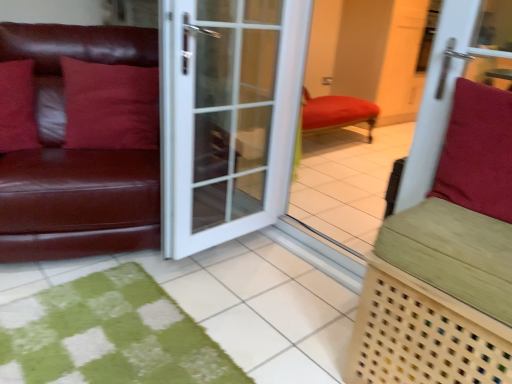
Question: Is matte leather couch at left at the back of green woven bench at right?

Choices:
 (A) yes
 (B) no

Answer: (B)

Question: Is green woven bench at right outside matte leather couch at left?

Choices:
 (A) yes
 (B) no

Answer: (A)

Question: Is green woven bench at right far away from matte leather couch at left?

Choices:
 (A) no
 (B) yes

Answer: (B)

Question: Is green woven bench at right taller than matte leather couch at left?

Choices:
 (A) yes
 (B) no

Answer: (B)

Question: From the image's perspective, is green woven bench at right under matte leather couch at left?

Choices:
 (A) yes
 (B) no

Answer: (A)

Question: From the image's perspective, is green woven bench at right located above matte leather couch at left?

Choices:
 (A) no
 (B) yes

Answer: (A)

Question: Considering the relative sizes of suede-like red cushion at right, which ranks as the first pillow in front-to-back order, and matte leather pillow at left, the 2th pillow when ordered from back to front, in the image provided, is suede-like red cushion at right, which ranks as the first pillow in front-to-back order, bigger than matte leather pillow at left, the 2th pillow when ordered from back to front,?

Choices:
 (A) yes
 (B) no

Answer: (A)

Question: From a real-world perspective, is suede-like red cushion at right, which ranks as the first pillow in front-to-back order, on top of matte leather pillow at left, which appears as the second pillow when viewed from the front?

Choices:
 (A) no
 (B) yes

Answer: (B)

Question: Does suede-like red cushion at right, the third pillow in the left-to-right sequence, come behind matte leather pillow at left, the first pillow when ordered from left to right?

Choices:
 (A) no
 (B) yes

Answer: (A)

Question: Considering the relative sizes of suede-like red cushion at right, arranged as the third pillow when viewed from the back, and matte leather pillow at left, which ranks as the third pillow in right-to-left order, in the image provided, is suede-like red cushion at right, arranged as the third pillow when viewed from the back, smaller than matte leather pillow at left, which ranks as the third pillow in right-to-left order,?

Choices:
 (A) no
 (B) yes

Answer: (A)

Question: Considering the relative positions of suede-like red cushion at right, which ranks as the first pillow in front-to-back order, and matte leather pillow at left, which appears as the second pillow when viewed from the front, in the image provided, is suede-like red cushion at right, which ranks as the first pillow in front-to-back order, to the left of matte leather pillow at left, which appears as the second pillow when viewed from the front, from the viewer's perspective?

Choices:
 (A) no
 (B) yes

Answer: (A)

Question: From a real-world perspective, is suede-like red cushion at right, the third pillow in the left-to-right sequence, under matte leather pillow at left, which appears as the second pillow when viewed from the front?

Choices:
 (A) no
 (B) yes

Answer: (A)

Question: Is suede-like red cushion at right, arranged as the third pillow when viewed from the back, taller than matte red pillow at left, the 2th pillow from the right?

Choices:
 (A) yes
 (B) no

Answer: (B)